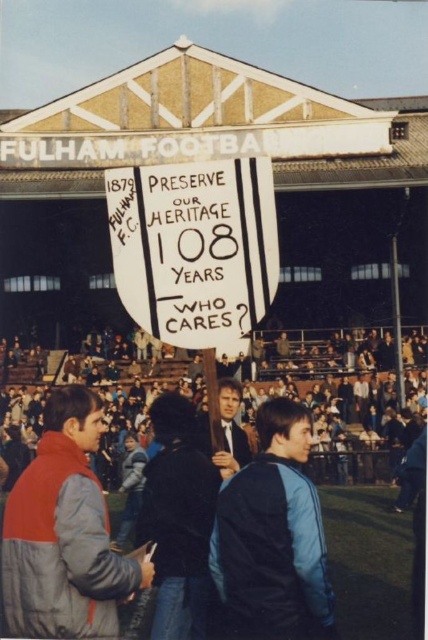
Question: Among these objects, which one is nearest to the camera?

Choices:
 (A) blue fabric jacket at center
 (B) gray down jacket at lower left
 (C) dark blue jacket at center
 (D) smooth black suit at center

Answer: (B)

Question: Which point is farther to the camera?

Choices:
 (A) (175, 545)
 (B) (202, 440)

Answer: (B)

Question: Is dark gray clothing at lower center positioned at the back of white paper sign at center?

Choices:
 (A) no
 (B) yes

Answer: (B)

Question: Is white paper sign at center closer to camera compared to blue fabric jacket at center?

Choices:
 (A) no
 (B) yes

Answer: (A)

Question: Can you confirm if white paper sign at center is wider than smooth black suit at center?

Choices:
 (A) yes
 (B) no

Answer: (A)

Question: Estimate the real-world distances between objects in this image. Which object is farther from the dark gray clothing at lower center?

Choices:
 (A) blue fabric jacket at center
 (B) dark blue jacket at center
 (C) gray down jacket at lower left
 (D) smooth black suit at center

Answer: (A)